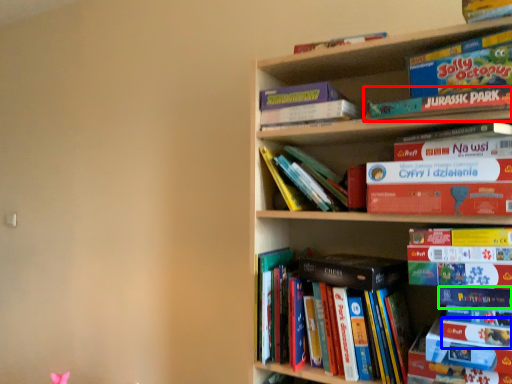
Question: Which object is the farthest from book (highlighted by a red box)? Choose among these: book (highlighted by a blue box) or book (highlighted by a green box).

Choices:
 (A) book
 (B) book

Answer: (A)